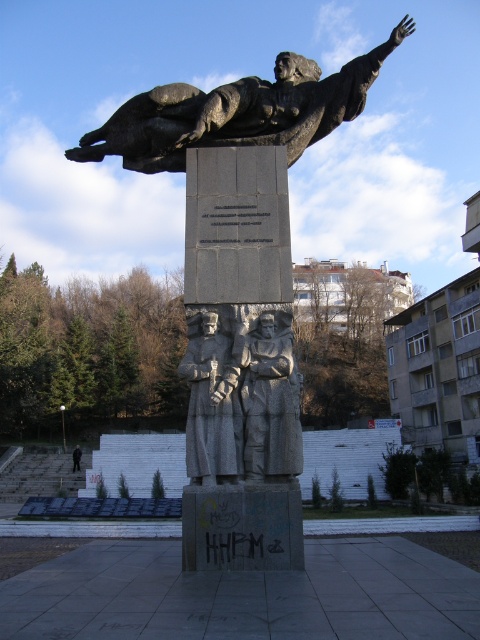
The image size is (480, 640). What do you see at coordinates (238, 112) in the screenshot?
I see `bronze statue at upper center` at bounding box center [238, 112].

Which is more to the left, bronze statue at upper center or dark gray stone statue at center?

dark gray stone statue at center is more to the left.

You are a GUI agent. You are given a task and a screenshot of the screen. Output one action in this format:
    pyautogui.click(x=<x>, y=<y>)
    Task: Click on the bronze statue at upper center
    This screenshot has width=480, height=640.
    Given the screenshot: What is the action you would take?
    pyautogui.click(x=238, y=112)

The height and width of the screenshot is (640, 480). What are the coordinates of `bronze statue at upper center` in the screenshot? It's located at (238, 112).

Which is more to the left, bronze statue at upper center or granite statue at center?

granite statue at center

Between point (339, 109) and point (207, 320), which one is positioned in front?

Point (207, 320) is more forward.

I want to click on bronze statue at upper center, so click(x=238, y=112).

Is bronze statue at center to the right of bronze statue at upper center from the viewer's perspective?

No, bronze statue at center is not to the right of bronze statue at upper center.

Which is more to the left, bronze statue at center or bronze statue at upper center?

bronze statue at center is more to the left.

Which is behind, point (276, 538) or point (182, 156)?

The point (182, 156) is more distant.

The image size is (480, 640). I want to click on bronze statue at center, so click(x=240, y=288).